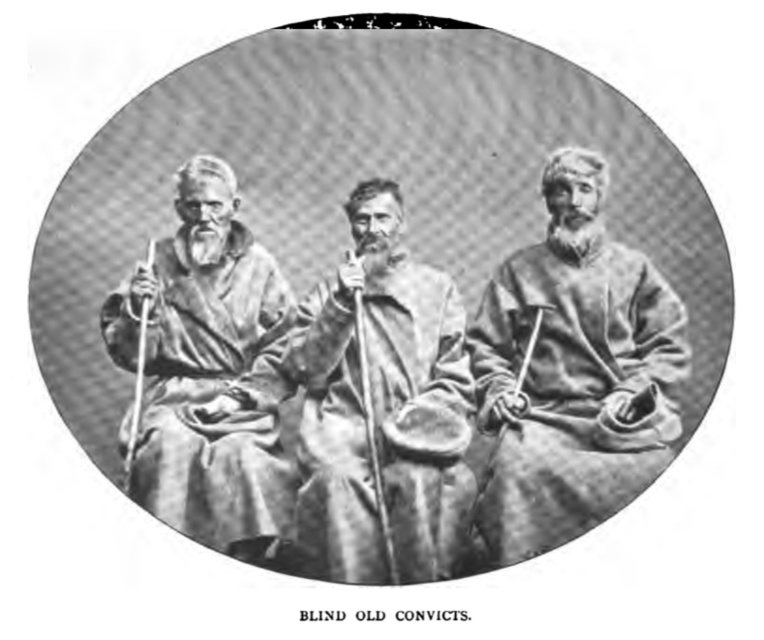
Question: Can you confirm if smooth gray robe at center is positioned to the right of smooth woolen robe at center?

Choices:
 (A) no
 (B) yes

Answer: (B)

Question: Which point is farther to the camera?

Choices:
 (A) smooth gray robe at center
 (B) smooth woolen robe at center
 (C) velvety brown robe at left

Answer: (A)

Question: Can you confirm if smooth gray robe at center is positioned above smooth woolen robe at center?

Choices:
 (A) yes
 (B) no

Answer: (A)

Question: From the image, what is the correct spatial relationship of smooth gray robe at center in relation to smooth wooden stick at center?

Choices:
 (A) left
 (B) right

Answer: (B)

Question: Which of these objects is positioned farthest from the velvety brown robe at left?

Choices:
 (A) smooth woolen robe at center
 (B) smooth wooden stick at center
 (C) smooth gray robe at center

Answer: (C)

Question: Which of the following is the farthest from the observer?

Choices:
 (A) smooth woolen robe at center
 (B) smooth gray robe at center
 (C) smooth wooden stick at center
 (D) velvety brown robe at left

Answer: (B)